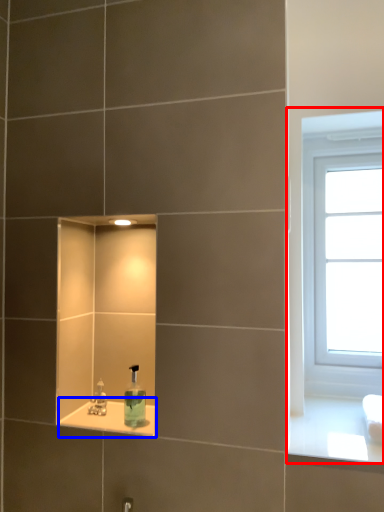
Question: Which object appears farthest to the camera in this image, window (highlighted by a red box) or window sill (highlighted by a blue box)?

Choices:
 (A) window
 (B) window sill

Answer: (A)